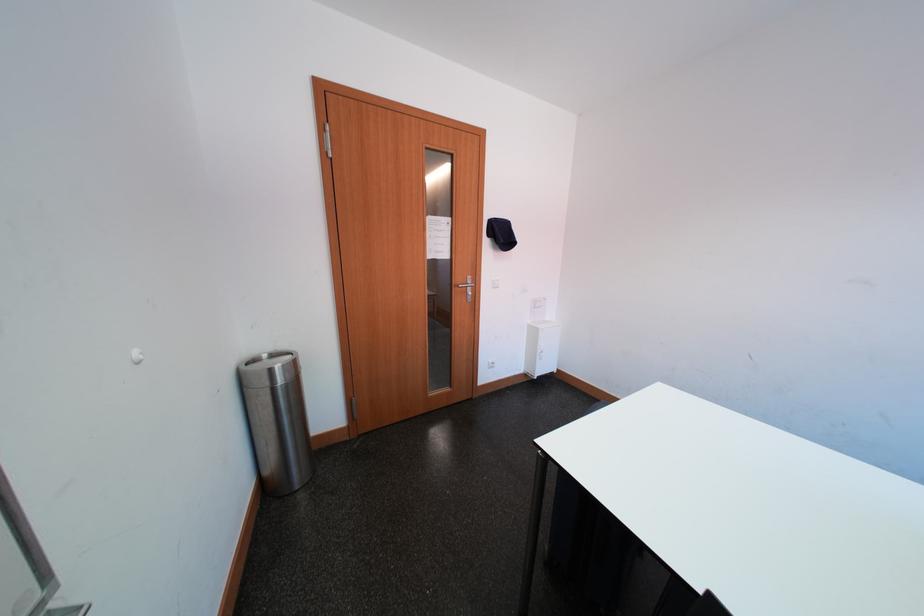
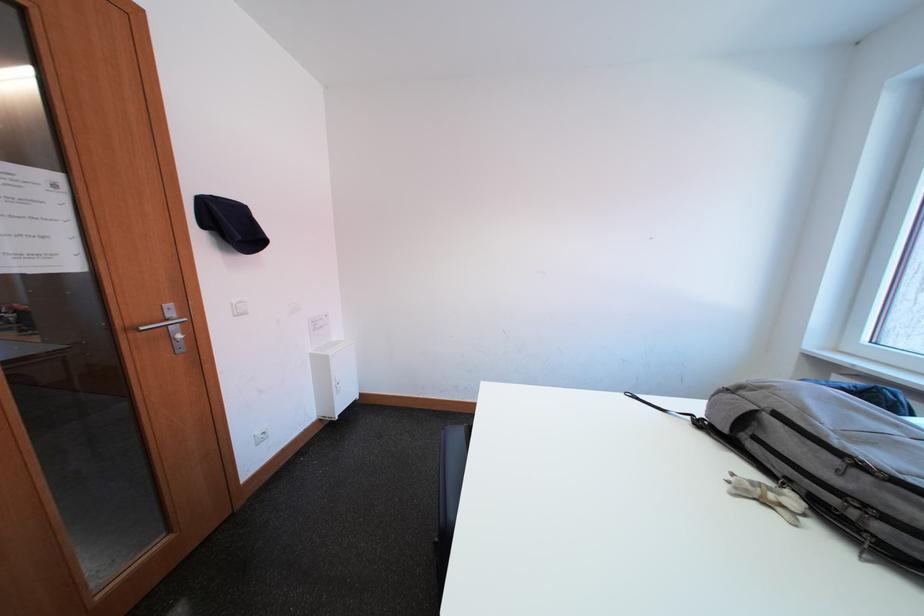
Find the pixel in the second image that matches point (479, 285) in the first image.

(180, 317)